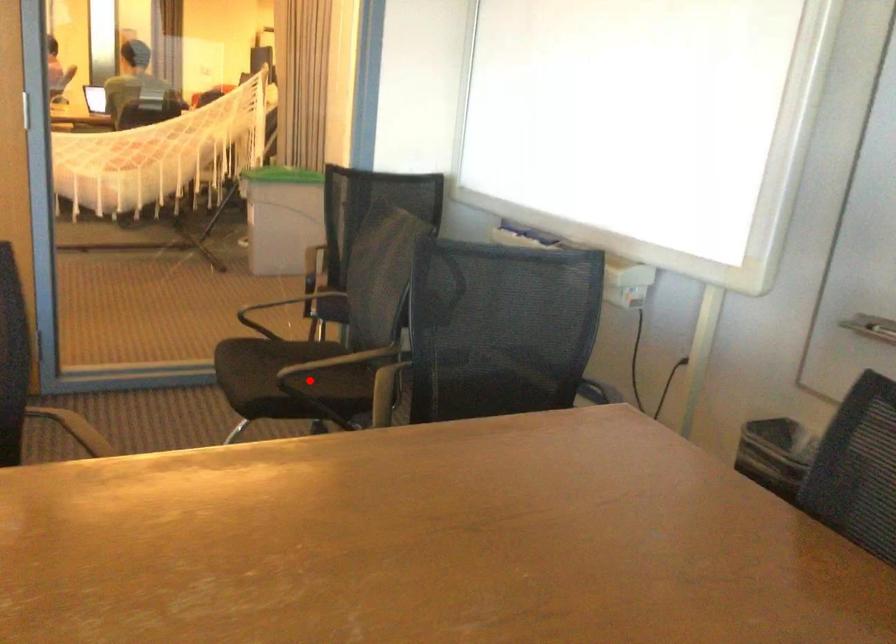
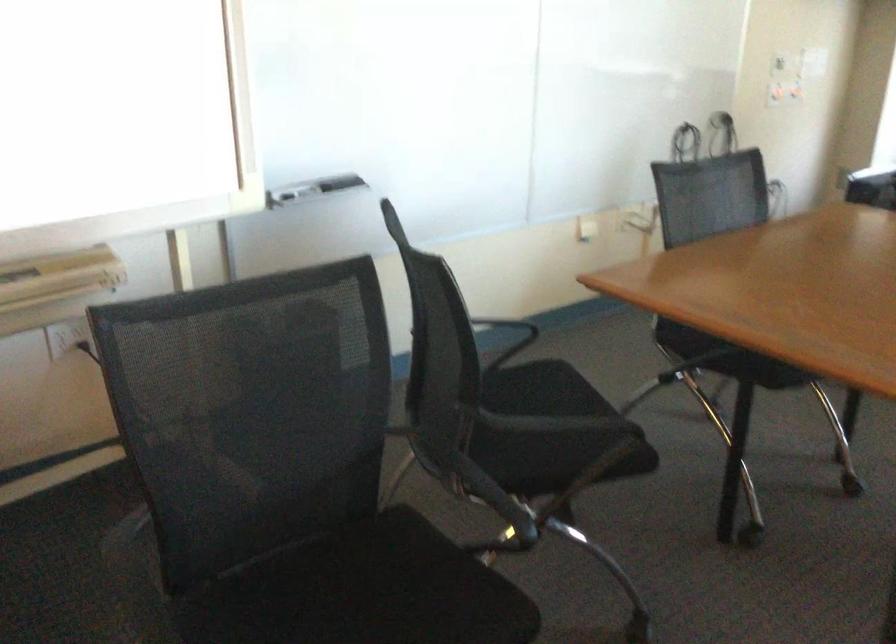
Question: I am providing you with two images of the same scene from different viewpoints. In image1, a red point is highlighted. Considering the same 3D point in image2, which of the following is correct?

Choices:
 (A) It is closer
 (B) It is farther

Answer: (A)